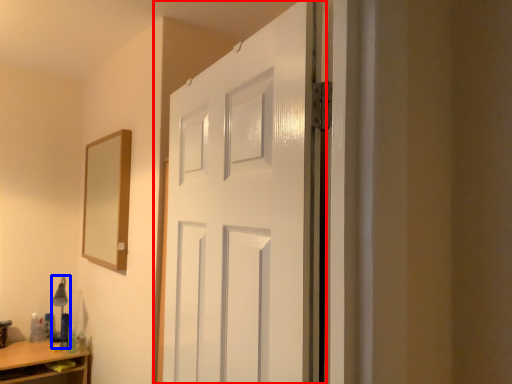
Question: Among these objects, which one is farthest to the camera, door (highlighted by a red box) or table lamp (highlighted by a blue box)?

Choices:
 (A) door
 (B) table lamp

Answer: (B)